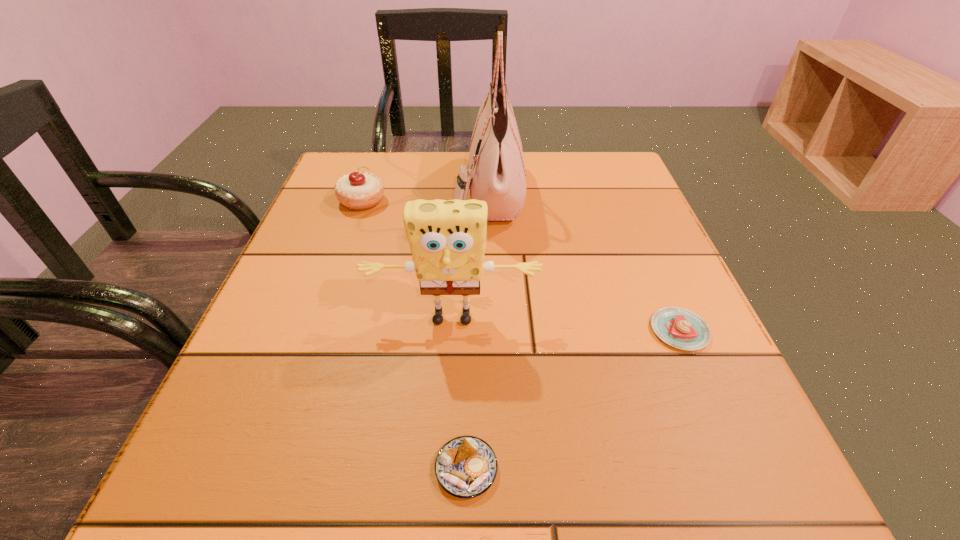
Identify the location of handbag. This screenshot has width=960, height=540. (497, 175).

You are a GUI agent. You are given a task and a screenshot of the screen. Output one action in this format:
    pyautogui.click(x=<x>, y=<y>)
    Task: Click on the sponge
    
    Given the screenshot: What is the action you would take?
    pyautogui.click(x=447, y=238)

This screenshot has width=960, height=540. I want to click on the tallest pastry, so click(x=363, y=190).

At what (x,y) coordinates should I click in order to perform the action: click on the farthest pastry. Please return your answer as a coordinate pair (x, y). This screenshot has width=960, height=540. Looking at the image, I should click on (363, 190).

Find the location of a particular element. the rightmost object is located at coordinates (680, 328).

At what (x,y) coordinates should I click in order to perform the action: click on the rightmost pastry. Please return your answer as a coordinate pair (x, y). The image size is (960, 540). Looking at the image, I should click on (680, 328).

Identify the location of the nearest pastry. This screenshot has width=960, height=540. (466, 466).

Find the location of a particular element. The width and height of the screenshot is (960, 540). the nearest object is located at coordinates (466, 466).

The width and height of the screenshot is (960, 540). What are the coordinates of `free space located on the side of the tallest object with the attached pouch` in the screenshot? It's located at tap(403, 192).

Identify the location of vacant region located on the side of the tallest object with the attached pouch. (362, 192).